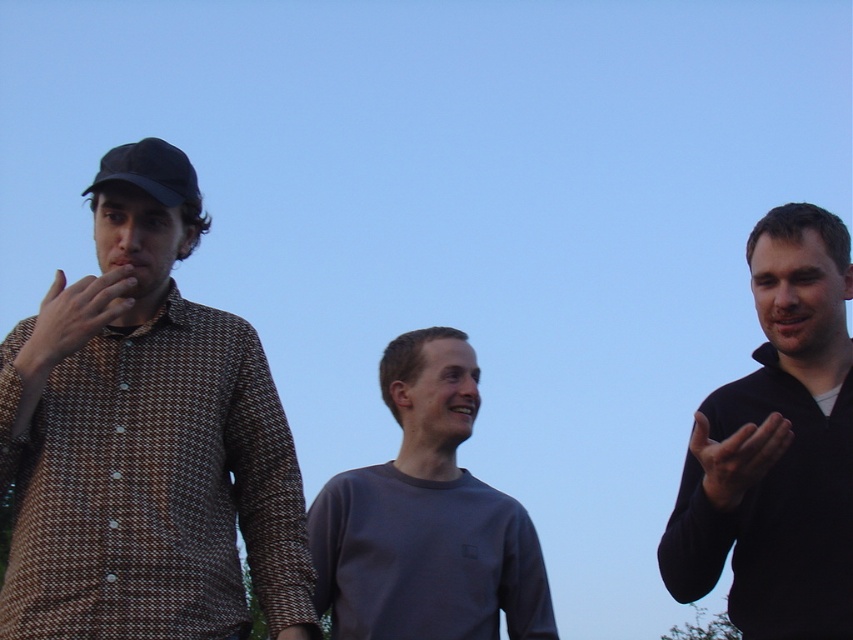
Question: Among these objects, which one is farthest from the camera?

Choices:
 (A) black matte baseball cap at left
 (B) black matte hand at right

Answer: (B)

Question: Is black matte sweater at right positioned at the back of matte brown shirt at left?

Choices:
 (A) no
 (B) yes

Answer: (B)

Question: Is black matte sweater at right closer to camera compared to matte brown shirt at left?

Choices:
 (A) yes
 (B) no

Answer: (B)

Question: Estimate the real-world distances between objects in this image. Which object is closer to the black matte sweater at right?

Choices:
 (A) black matte hand at right
 (B) brown houndstooth shirt at left
 (C) matte brown shirt at left

Answer: (A)

Question: Considering the relative positions of black matte hand at right and black matte baseball cap at left in the image provided, where is black matte hand at right located with respect to black matte baseball cap at left?

Choices:
 (A) above
 (B) below

Answer: (B)

Question: Which object is positioned closest to the brown houndstooth shirt at left?

Choices:
 (A) black matte sweater at right
 (B) black matte hand at right

Answer: (A)